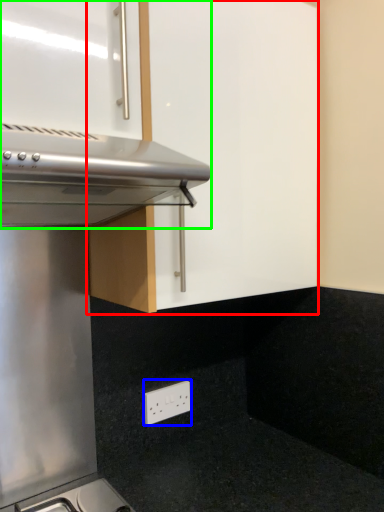
Question: Considering the real-world distances, which object is closest to cabinetry (highlighted by a red box)? electric outlet (highlighted by a blue box) or oven (highlighted by a green box).

Choices:
 (A) electric outlet
 (B) oven

Answer: (B)